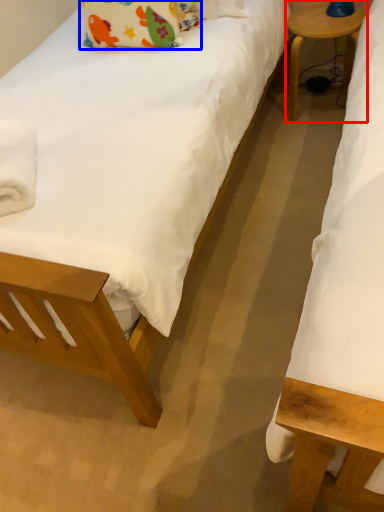
Question: Which object appears closest to the camera in this image, table (highlighted by a red box) or pillow (highlighted by a blue box)?

Choices:
 (A) table
 (B) pillow

Answer: (B)